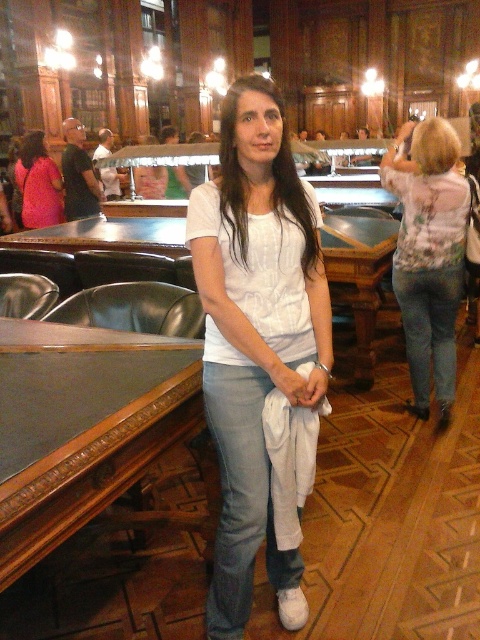
You are a customer at this elegant bar and see two blouses at the center. Which one is positioned lower, the floral print blouse at center or the matte pink blouse at center?

The floral print blouse at center is positioned lower than the matte pink blouse at center according to the description.

You are a customer at the bar and want to choose between the floral print blouse at center and the matte pink blouse at center. Which one is more accessible to you?

The floral print blouse at center is closer to the viewer than the matte pink blouse at center, so it is more accessible.